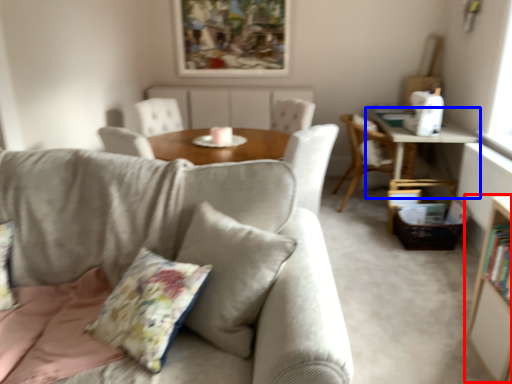
Question: Which point is closer to the camera, bookcase (highlighted by a red box) or table (highlighted by a blue box)?

Choices:
 (A) bookcase
 (B) table

Answer: (A)